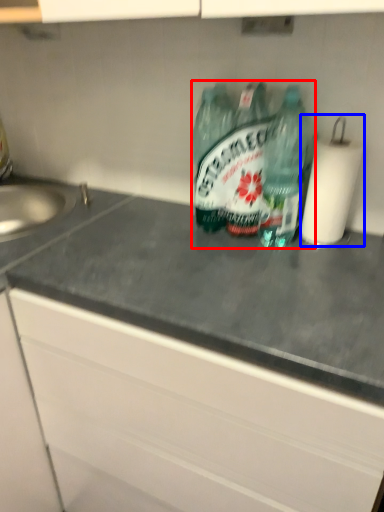
Question: Which object is further to the camera taking this photo, bottle (highlighted by a red box) or paper towel (highlighted by a blue box)?

Choices:
 (A) bottle
 (B) paper towel

Answer: (A)